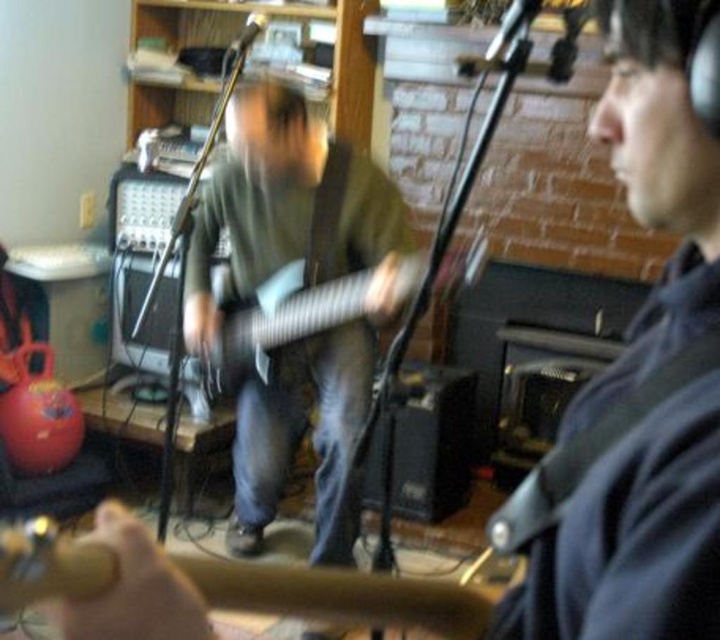
Which is more to the left, dark blue shirt at center or metallic silver guitar at center?

metallic silver guitar at center

Between point (608, 144) and point (292, 300), which one is positioned behind?

The point (292, 300) is more distant.

Does point (666, 20) come behind point (243, 326)?

No, it is not.

Locate an element on the screen. The image size is (720, 640). dark blue shirt at center is located at coordinates (638, 381).

What do you see at coordinates (96, 579) in the screenshot? This screenshot has height=640, width=720. I see `wooden acoustic guitar at center` at bounding box center [96, 579].

Is wooden acoustic guitar at center closer to the viewer compared to metallic silver guitar at center?

Yes, it is in front of metallic silver guitar at center.

Does point (99, 554) come farther from viewer compared to point (284, 339)?

No, it is in front of (284, 339).

Find the location of a particular element. This screenshot has height=640, width=720. wooden acoustic guitar at center is located at coordinates (96, 579).

Is dark blue shirt at center wider than wooden acoustic guitar at center?

No, dark blue shirt at center is not wider than wooden acoustic guitar at center.

Which is below, dark blue shirt at center or wooden acoustic guitar at center?

Positioned lower is wooden acoustic guitar at center.

Does point (644, 144) lie in front of point (30, 529)?

No.

The width and height of the screenshot is (720, 640). I want to click on dark blue shirt at center, so click(x=638, y=381).